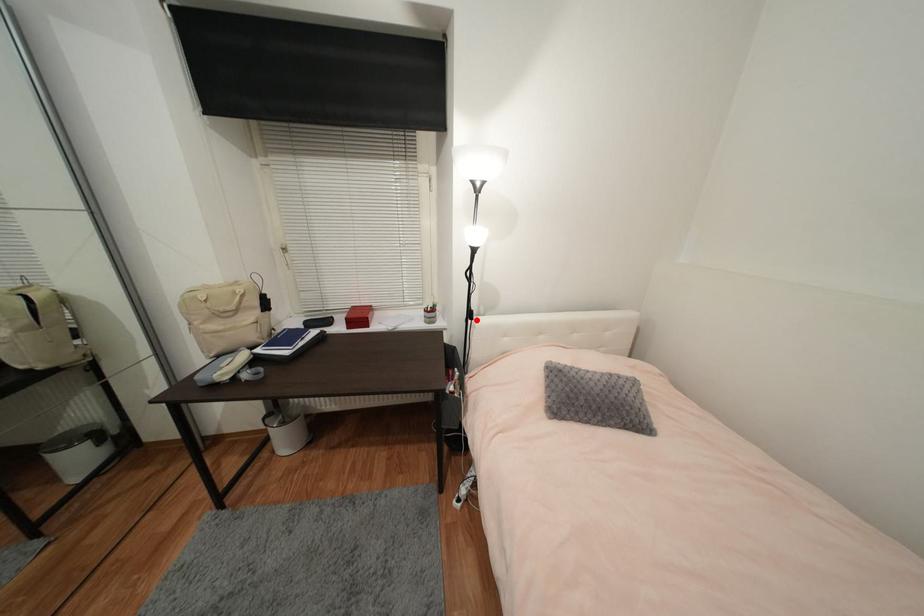
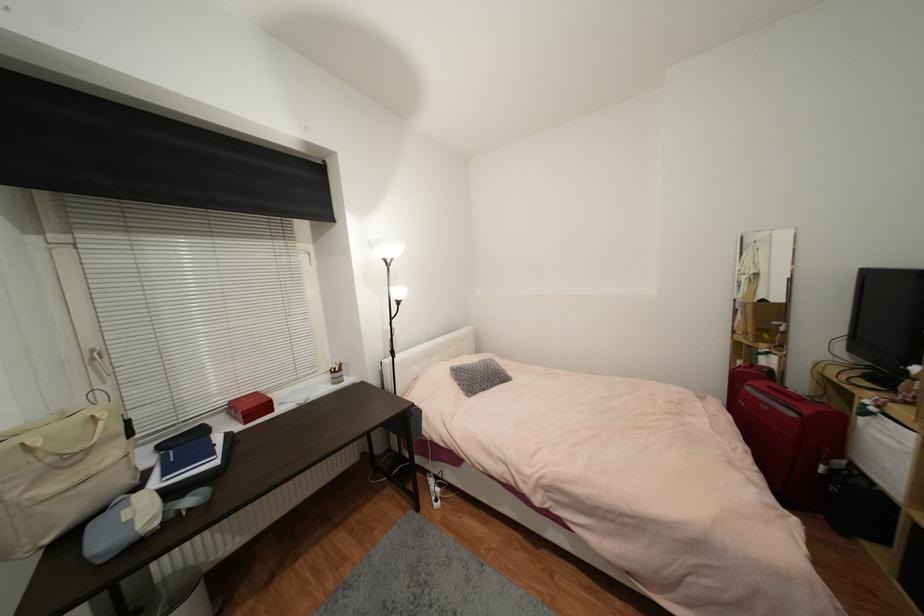
Question: I am providing you with two images of the same scene from different viewpoints. In image1, a red point is highlighted. Considering the same 3D point in image2, which of the following is correct?

Choices:
 (A) It is closer
 (B) It is farther

Answer: (A)